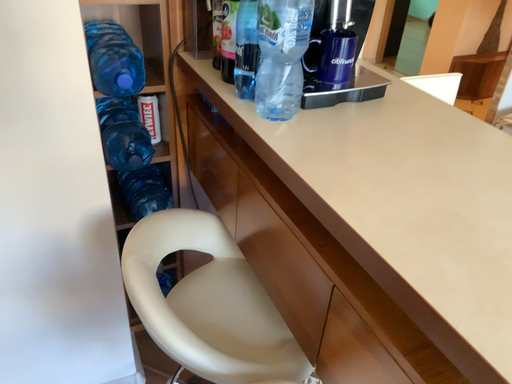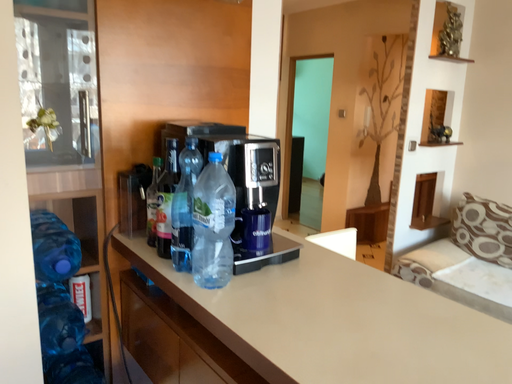
Question: How did the camera likely rotate when shooting the video?

Choices:
 (A) rotated right
 (B) rotated left

Answer: (A)